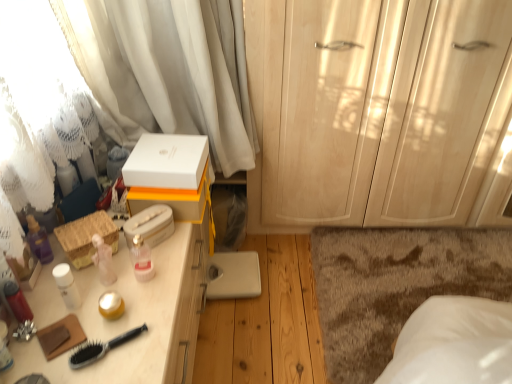
Identify the location of vacant area that lies to the right of pink glossy bottle at center, positioned as the 2th toiletry in left-to-right order. The height and width of the screenshot is (384, 512). (168, 271).